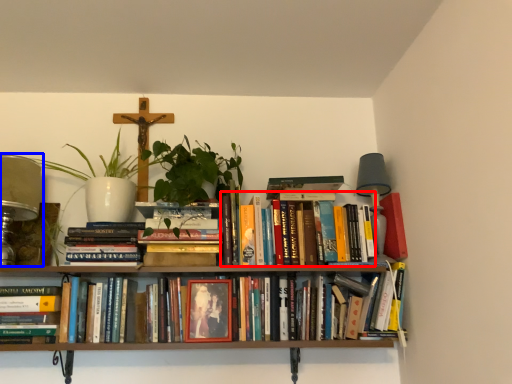
Question: Which of the following is the farthest to the observer, book (highlighted by a red box) or table lamp (highlighted by a blue box)?

Choices:
 (A) book
 (B) table lamp

Answer: (A)